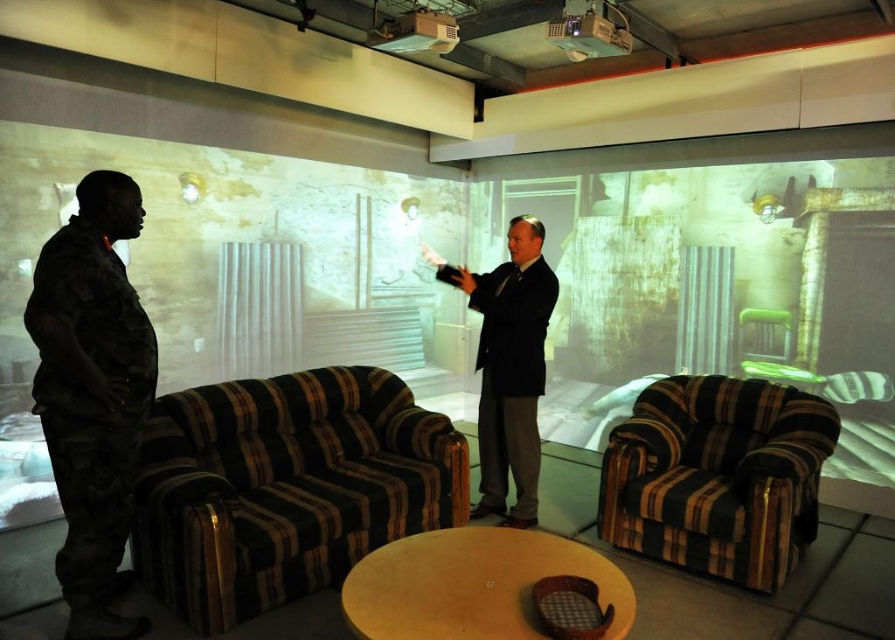
Question: Which object is positioned farthest from the dark suit at center?

Choices:
 (A) striped fabric couch at center
 (B) striped fabric armchair at center

Answer: (A)

Question: Which point is closer to the camera?

Choices:
 (A) matte black projector at upper center
 (B) striped fabric armchair at center
 (C) camouflage fabric at left
 (D) metallic projector at upper center

Answer: (C)

Question: Does metallic projector at upper center appear on the right side of matte black projector at upper center?

Choices:
 (A) yes
 (B) no

Answer: (A)

Question: Which point appears closest to the camera in this image?

Choices:
 (A) (189, 536)
 (B) (556, 45)
 (C) (522, 480)
 (D) (86, 547)

Answer: (D)

Question: Is dark suit at center positioned in front of metallic projector at upper center?

Choices:
 (A) yes
 (B) no

Answer: (B)

Question: Is the position of striped fabric couch at center more distant than that of metallic projector at upper center?

Choices:
 (A) yes
 (B) no

Answer: (B)